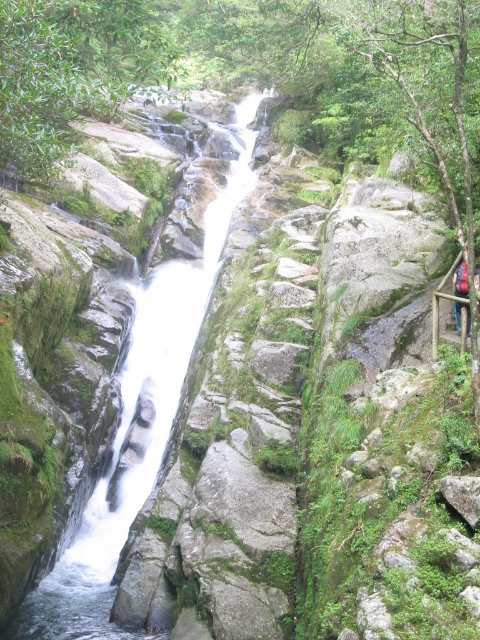
Question: Is the position of white smooth stream at center less distant than that of camouflage fabric backpack at right?

Choices:
 (A) no
 (B) yes

Answer: (A)

Question: Is white smooth stream at center closer to camera compared to camouflage fabric backpack at right?

Choices:
 (A) no
 (B) yes

Answer: (A)

Question: Is white smooth stream at center above camouflage fabric backpack at right?

Choices:
 (A) yes
 (B) no

Answer: (A)

Question: Which point is closer to the camera taking this photo?

Choices:
 (A) (465, 288)
 (B) (176, 340)

Answer: (A)